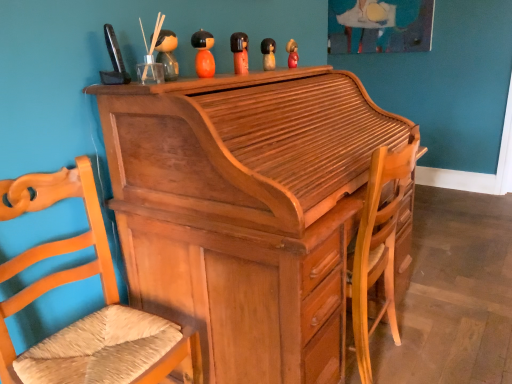
This screenshot has width=512, height=384. What do you see at coordinates (292, 53) in the screenshot?
I see `matte wooden figurine at upper center, arranged as the fifth toy when viewed from the front` at bounding box center [292, 53].

You are a GUI agent. You are given a task and a screenshot of the screen. Output one action in this format:
    pyautogui.click(x=<x>, y=<y>)
    Task: Click on the matte yellow doll at center, the 2th toy viewed from the back
    
    Given the screenshot: What is the action you would take?
    pyautogui.click(x=268, y=54)

Which is behind, matte wooden figurine at upper center, which ranks as the 1th toy in back-to-front order, or orange matte wooden doll at upper center, positioned as the fourth toy in right-to-left order?

matte wooden figurine at upper center, which ranks as the 1th toy in back-to-front order, is more distant.

Looking at this image, could orange matte wooden doll at upper center, the 2th toy when ordered from left to right, be considered to be inside matte wooden figurine at upper center, arranged as the fifth toy when viewed from the front?

No, orange matte wooden doll at upper center, the 2th toy when ordered from left to right, is not inside matte wooden figurine at upper center, arranged as the fifth toy when viewed from the front.

From the image's perspective, which is above, matte wooden figurine at upper center, the 1th toy in the right-to-left sequence, or orange matte wooden doll at upper center, the 2th toy when ordered from left to right?

matte wooden figurine at upper center, the 1th toy in the right-to-left sequence, appears higher in the image.

Between matte wooden figurine at upper center, the 5th toy from the left, and orange matte wooden doll at upper center, positioned as the fourth toy in right-to-left order, which one has larger width?

orange matte wooden doll at upper center, positioned as the fourth toy in right-to-left order, is wider.

Find the location of `desk in front of the matte wooden figurine at upper center, arranged as the 1th toy when viewed from the left`. desk in front of the matte wooden figurine at upper center, arranged as the 1th toy when viewed from the left is located at coordinates (246, 210).

In the scene shown: From the image's perspective, which is below, light brown wood desk at center or matte wooden figurine at upper center, arranged as the 1th toy when viewed from the left?

light brown wood desk at center.

Would you say light brown wood desk at center is to the left or to the right of matte wooden figurine at upper center, which appears as the 5th toy when viewed from the back, in the picture?

From the image, it's evident that light brown wood desk at center is to the right of matte wooden figurine at upper center, which appears as the 5th toy when viewed from the back.

In terms of width, does light brown wood desk at center look wider or thinner when compared to matte wooden figurine at upper center, which appears as the 5th toy when viewed from the back?

light brown wood desk at center is wider than matte wooden figurine at upper center, which appears as the 5th toy when viewed from the back.

From a real-world perspective, is matte orange doll at upper center, the 3th toy when ordered from back to front, below orange matte wooden doll at upper center, the 2th toy when ordered from left to right?

Yes, from a real-world perspective, matte orange doll at upper center, the 3th toy when ordered from back to front, is below orange matte wooden doll at upper center, the 2th toy when ordered from left to right.

Locate an element on the screen. This screenshot has width=512, height=384. the 1st toy positioned below the matte orange doll at upper center, the 3th toy when ordered from back to front (from the image's perspective) is located at coordinates (203, 53).

Can we say matte orange doll at upper center, positioned as the third toy in left-to-right order, lies outside orange matte wooden doll at upper center, the 2th toy when ordered from left to right?

Yes.

From the image's perspective, between matte orange doll at upper center, positioned as the third toy in left-to-right order, and orange matte wooden doll at upper center, the 4th toy when ordered from back to front, who is located below?

orange matte wooden doll at upper center, the 4th toy when ordered from back to front, is shown below in the image.

Is matte orange doll at upper center, the 3th toy when ordered from back to front, completely or partially inside light brown wood desk at center?

No.

Is matte orange doll at upper center, positioned as the third toy in left-to-right order, at the back of light brown wood desk at center?

No, light brown wood desk at center is not facing the opposite direction of matte orange doll at upper center, positioned as the third toy in left-to-right order.

Is there a large distance between light brown wood desk at center and matte orange doll at upper center, the 3th toy when ordered from back to front?

Actually, light brown wood desk at center and matte orange doll at upper center, the 3th toy when ordered from back to front, are a little close together.

Identify the location of desk on the right of matte orange doll at upper center, placed as the 3th toy when sorted from right to left. (246, 210).

Does matte yellow doll at center, positioned as the 4th toy in front-to-back order, touch matte orange doll at upper center, positioned as the third toy in left-to-right order?

No, matte yellow doll at center, positioned as the 4th toy in front-to-back order, is not making contact with matte orange doll at upper center, positioned as the third toy in left-to-right order.

Is matte yellow doll at center, the 2th toy viewed from the back, not within matte orange doll at upper center, placed as the 3th toy when sorted from right to left?

matte yellow doll at center, the 2th toy viewed from the back, is positioned outside matte orange doll at upper center, placed as the 3th toy when sorted from right to left.

From the image's perspective, does matte yellow doll at center, the 2th toy viewed from the back, appear higher than matte orange doll at upper center, the 3th toy when ordered from back to front?

Correct, matte yellow doll at center, the 2th toy viewed from the back, appears higher than matte orange doll at upper center, the 3th toy when ordered from back to front, in the image.

Is matte yellow doll at center, positioned as the 4th toy in front-to-back order, bigger or smaller than matte orange doll at upper center, placed as the 3th toy when sorted from right to left?

Clearly, matte yellow doll at center, positioned as the 4th toy in front-to-back order, is smaller in size than matte orange doll at upper center, placed as the 3th toy when sorted from right to left.

From the image's perspective, is light brown wood desk at center located above or below matte wooden figurine at upper center, the 5th toy from the left?

Clearly, from the image's perspective, light brown wood desk at center is below matte wooden figurine at upper center, the 5th toy from the left.

What's the angular difference between light brown wood desk at center and matte wooden figurine at upper center, the 1th toy in the right-to-left sequence,'s facing directions?

There is a 2.12-degree angle between the facing directions of light brown wood desk at center and matte wooden figurine at upper center, the 1th toy in the right-to-left sequence.

From the picture: Considering the relative positions of light brown wood desk at center and matte wooden figurine at upper center, the 5th toy from the left, in the image provided, is light brown wood desk at center to the left or to the right of matte wooden figurine at upper center, the 5th toy from the left,?

Based on their positions, light brown wood desk at center is located to the left of matte wooden figurine at upper center, the 5th toy from the left.

Which point is more distant from viewer, (354, 106) or (290, 65)?

The point (290, 65) is more distant.

Looking at this image, how many degrees apart are the facing directions of orange matte wooden doll at upper center, the 4th toy when ordered from back to front, and matte wooden figurine at upper center, positioned as the first toy in front-to-back order?

The angular difference between orange matte wooden doll at upper center, the 4th toy when ordered from back to front, and matte wooden figurine at upper center, positioned as the first toy in front-to-back order, is 0.0348 degrees.

Looking at this image, do you think orange matte wooden doll at upper center, the 4th toy when ordered from back to front, is within matte wooden figurine at upper center, which ranks as the fifth toy in right-to-left order, or outside of it?

The correct answer is: outside.

The width and height of the screenshot is (512, 384). I want to click on toy in front of the orange matte wooden doll at upper center, the 2th toy when ordered from left to right, so click(167, 54).

Is orange matte wooden doll at upper center, the 4th toy when ordered from back to front, wider than matte wooden figurine at upper center, positioned as the first toy in front-to-back order?

Incorrect, the width of orange matte wooden doll at upper center, the 4th toy when ordered from back to front, does not surpass that of matte wooden figurine at upper center, positioned as the first toy in front-to-back order.

From a real-world perspective, which toy is the 4th one above the matte wooden figurine at upper center, which ranks as the 1th toy in back-to-front order? Please provide its 2D coordinates.

[(203, 53)]

At what (x,y) coordinates should I click in order to perform the action: click on the 4th toy to the left of the light brown wood desk at center, counting from the anchor's position. Please return your answer as a coordinate pair (x, y). Looking at the image, I should click on (167, 54).

From the image, which object appears to be nearer to matte wooden figurine at upper center, the 1th toy in the right-to-left sequence, matte orange doll at upper center, placed as the 3th toy when sorted from right to left, or light brown wood desk at center?

Based on the image, matte orange doll at upper center, placed as the 3th toy when sorted from right to left, appears to be nearer to matte wooden figurine at upper center, the 1th toy in the right-to-left sequence.

Based on the photo, looking at the image, which one is located closer to matte wooden figurine at upper center, the 1th toy in the right-to-left sequence, light brown wood desk at center or matte wooden figurine at upper center, arranged as the 1th toy when viewed from the left?

The object closer to matte wooden figurine at upper center, the 1th toy in the right-to-left sequence, is matte wooden figurine at upper center, arranged as the 1th toy when viewed from the left.

Based on their spatial positions, is light brown wood desk at center or matte wooden figurine at upper center, which appears as the 5th toy when viewed from the back, further from matte yellow doll at center, positioned as the 4th toy in front-to-back order?

Among the two, light brown wood desk at center is located further to matte yellow doll at center, positioned as the 4th toy in front-to-back order.

Based on their spatial positions, is light brown wood desk at center or matte orange doll at upper center, placed as the 3th toy when sorted from right to left, closer to matte yellow doll at center, positioned as the 4th toy in front-to-back order?

matte orange doll at upper center, placed as the 3th toy when sorted from right to left.

Based on the photo, from the image, which object appears to be nearer to orange matte wooden doll at upper center, which is the 2th toy in front-to-back order, wooden woven seat at left or matte wooden figurine at upper center, arranged as the 1th toy when viewed from the left?

matte wooden figurine at upper center, arranged as the 1th toy when viewed from the left.

Based on their spatial positions, is light brown wood desk at center or matte wooden figurine at upper center, the 5th toy from the left, closer to matte wooden figurine at upper center, which ranks as the fifth toy in right-to-left order?

light brown wood desk at center.

Looking at this image, estimate the real-world distances between objects in this image. Which object is closer to orange matte wooden doll at upper center, the 4th toy when ordered from back to front, matte wooden figurine at upper center, which ranks as the 1th toy in back-to-front order, or matte orange doll at upper center, placed as the 3th toy when sorted from right to left?

matte orange doll at upper center, placed as the 3th toy when sorted from right to left, is closer to orange matte wooden doll at upper center, the 4th toy when ordered from back to front.

Considering their positions, is wooden woven seat at left positioned further to matte yellow doll at center, which is counted as the second toy, starting from the right, than matte wooden figurine at upper center, the 5th toy from the left?

Based on the image, wooden woven seat at left appears to be further to matte yellow doll at center, which is counted as the second toy, starting from the right.

Locate an element on the screen. This screenshot has width=512, height=384. toy between matte wooden figurine at upper center, which ranks as the fifth toy in right-to-left order, and matte orange doll at upper center, marked as the 3th toy in a front-to-back arrangement, in the front-back direction is located at coordinates (203, 53).

The height and width of the screenshot is (384, 512). Find the location of `toy between orange matte wooden doll at upper center, which is the 2th toy in front-to-back order, and light brown wood desk at center from top to bottom`. toy between orange matte wooden doll at upper center, which is the 2th toy in front-to-back order, and light brown wood desk at center from top to bottom is located at coordinates (167, 54).

You are a GUI agent. You are given a task and a screenshot of the screen. Output one action in this format:
    pyautogui.click(x=<x>, y=<y>)
    Task: Click on the toy between matte orange doll at upper center, marked as the 3th toy in a front-to-back arrangement, and matte wooden figurine at upper center, the 5th toy from the left, in the front-back direction
    Image resolution: width=512 pixels, height=384 pixels.
    Given the screenshot: What is the action you would take?
    pyautogui.click(x=268, y=54)

I want to click on desk between matte orange doll at upper center, marked as the 3th toy in a front-to-back arrangement, and wooden woven seat at left vertically, so click(x=246, y=210).